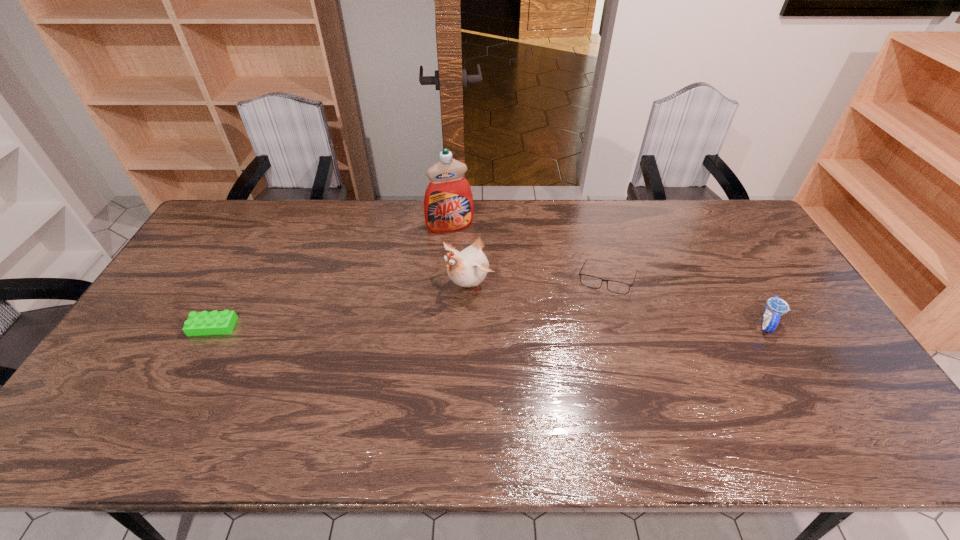
Locate an element on the screen. vacant space on the desktop that is between the shortest object and the third tallest object and is positioned with the lenses facing outward on the second object from right to left is located at coordinates (540, 325).

You are a GUI agent. You are given a task and a screenshot of the screen. Output one action in this format:
    pyautogui.click(x=<x>, y=<y>)
    Task: Click on the free space on the desktop that is between the leftmost object and the rightmost object and is positioned on the front surface of the detergent
    This screenshot has width=960, height=540.
    Given the screenshot: What is the action you would take?
    pyautogui.click(x=491, y=325)

At what (x,y) coordinates should I click in order to perform the action: click on free space on the desktop that is between the Lego and the third shortest object and is positioned at the beak of the bird. Please return your answer as a coordinate pair (x, y). This screenshot has height=540, width=960. Looking at the image, I should click on (421, 325).